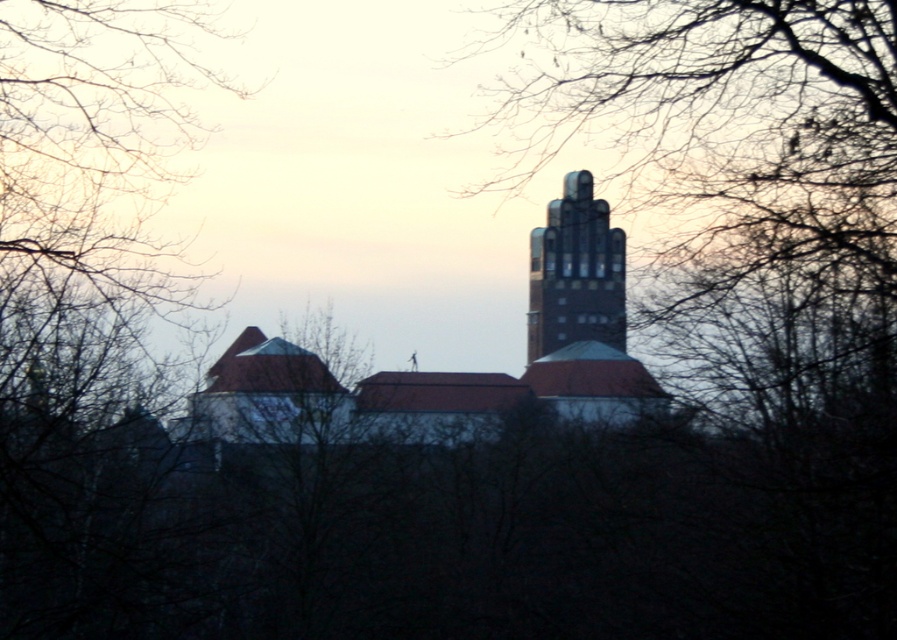
Question: Which of the following is the closest to the observer?

Choices:
 (A) (565, 305)
 (B) (549, 264)

Answer: (B)

Question: Can you confirm if brown textured church at center is thinner than dark brick tower at center?

Choices:
 (A) no
 (B) yes

Answer: (A)

Question: Can you confirm if brown textured church at center is positioned to the right of dark brick tower at center?

Choices:
 (A) no
 (B) yes

Answer: (A)

Question: Which point is closer to the camera?

Choices:
 (A) dark brick tower at center
 (B) brown textured church at center

Answer: (A)

Question: Can you confirm if brown textured church at center is positioned below dark brick tower at center?

Choices:
 (A) yes
 (B) no

Answer: (A)